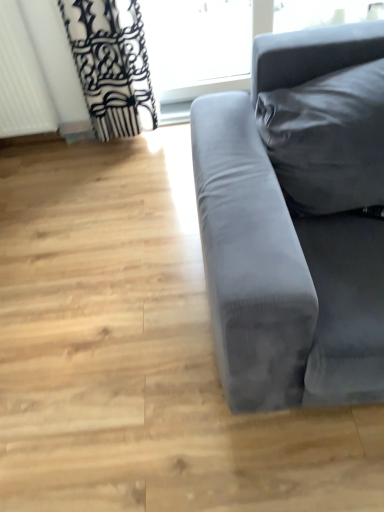
Question: Is the position of velvet gray couch at right more distant than that of transparent glass window at upper center?

Choices:
 (A) yes
 (B) no

Answer: (B)

Question: Is velvet gray couch at right far away from transparent glass window at upper center?

Choices:
 (A) yes
 (B) no

Answer: (A)

Question: Is the position of velvet gray couch at right less distant than that of transparent glass window at upper center?

Choices:
 (A) yes
 (B) no

Answer: (A)

Question: Can you confirm if velvet gray couch at right is positioned to the right of transparent glass window at upper center?

Choices:
 (A) yes
 (B) no

Answer: (B)

Question: Is velvet gray couch at right taller than transparent glass window at upper center?

Choices:
 (A) no
 (B) yes

Answer: (B)

Question: Based on their sizes in the image, would you say white textured radiator at left is bigger or smaller than transparent glass window at upper center?

Choices:
 (A) big
 (B) small

Answer: (B)

Question: From a real-world perspective, is white textured radiator at left positioned above or below transparent glass window at upper center?

Choices:
 (A) below
 (B) above

Answer: (B)

Question: Looking at their shapes, would you say white textured radiator at left is wider or thinner than transparent glass window at upper center?

Choices:
 (A) thin
 (B) wide

Answer: (B)

Question: In terms of height, does white textured radiator at left look taller or shorter compared to transparent glass window at upper center?

Choices:
 (A) short
 (B) tall

Answer: (B)

Question: Is transparent glass window at upper center situated inside velvet gray couch at right or outside?

Choices:
 (A) inside
 (B) outside

Answer: (B)

Question: Considering the positions of point (163, 29) and point (273, 208), is point (163, 29) closer or farther from the camera than point (273, 208)?

Choices:
 (A) closer
 (B) farther

Answer: (B)

Question: From the image's perspective, is transparent glass window at upper center above or below velvet gray couch at right?

Choices:
 (A) above
 (B) below

Answer: (A)

Question: Considering the relative positions of transparent glass window at upper center and velvet gray couch at right in the image provided, is transparent glass window at upper center to the left or to the right of velvet gray couch at right?

Choices:
 (A) left
 (B) right

Answer: (B)

Question: Is point (344, 357) closer or farther from the camera than point (19, 135)?

Choices:
 (A) closer
 (B) farther

Answer: (A)

Question: Looking at the image, does velvet gray couch at right seem bigger or smaller compared to white textured radiator at left?

Choices:
 (A) small
 (B) big

Answer: (B)